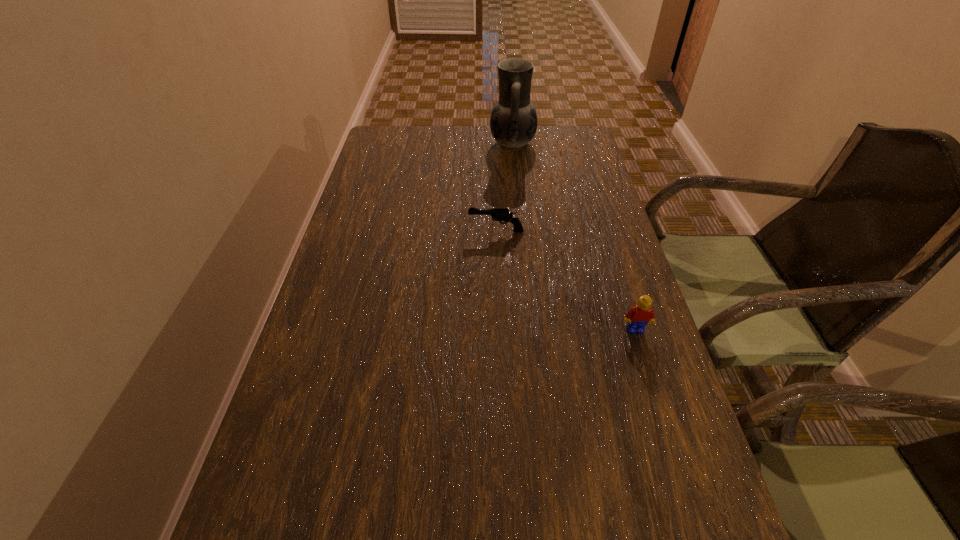
Locate an element on the screen. The image size is (960, 540). free location located 0.260m at the end of the barrel of the shortest object is located at coordinates (372, 231).

This screenshot has height=540, width=960. Find the location of `vacant region located 0.120m at the end of the barrel of the shortest object`. vacant region located 0.120m at the end of the barrel of the shortest object is located at coordinates (423, 231).

You are a GUI agent. You are given a task and a screenshot of the screen. Output one action in this format:
    pyautogui.click(x=<x>, y=<y>)
    Task: Click on the blank space located 0.270m at the end of the barrel of the shortest object
    
    Given the screenshot: What is the action you would take?
    pyautogui.click(x=368, y=231)

Where is `object present at the far edge`? object present at the far edge is located at coordinates (513, 123).

Find the location of `object that is at the right edge`. object that is at the right edge is located at coordinates (638, 316).

Identify the location of free space at the far edge of the desktop. (420, 150).

You are a GUI agent. You are given a task and a screenshot of the screen. Output one action in this format:
    pyautogui.click(x=<x>, y=<y>)
    Task: Click on the vacant space at the left edge of the desktop
    
    Given the screenshot: What is the action you would take?
    pyautogui.click(x=379, y=340)

What are the coordinates of `blank area at the right edge` in the screenshot? It's located at (606, 194).

At what (x,y) coordinates should I click in order to perform the action: click on vacant region at the far right corner of the desktop. Please return your answer as a coordinate pair (x, y). Looking at the image, I should click on (539, 135).

The height and width of the screenshot is (540, 960). What are the coordinates of `free space between the Lego and the shortest object` in the screenshot? It's located at (565, 280).